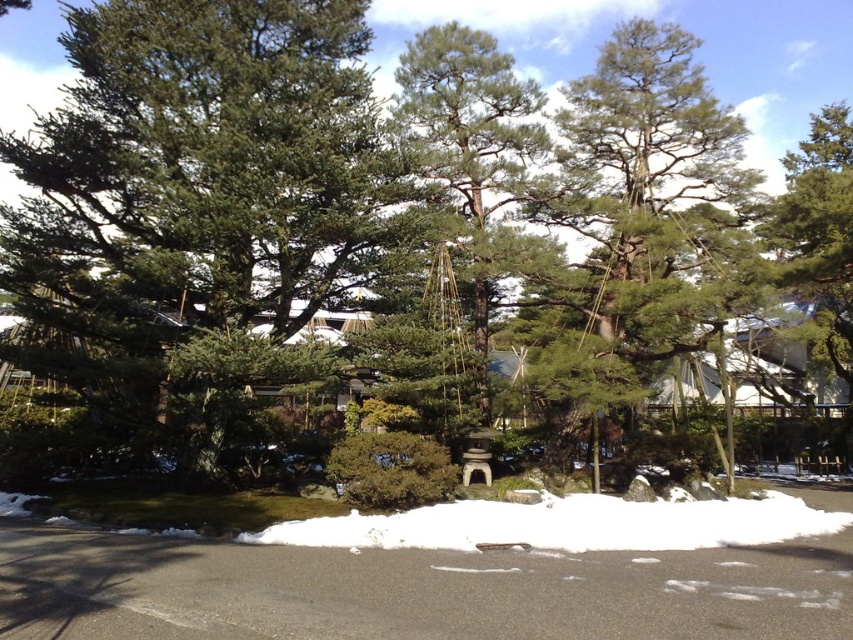
Does green matte tree at center have a greater height compared to green needle-like at center?

Yes.

Is green matte tree at center to the right of green needle-like at center from the viewer's perspective?

Incorrect, green matte tree at center is not on the right side of green needle-like at center.

Between point (337, 52) and point (508, 205), which one is positioned in front?

Point (337, 52) is in front.

Where is `green matte tree at center`? green matte tree at center is located at coordinates (201, 204).

Consider the image. Is green matte tree at center closer to the viewer compared to white powdery snow at center?

No, green matte tree at center is further to the viewer.

Consider the image. Who is more distant from viewer, (138, 396) or (555, 524)?

Positioned behind is point (138, 396).

Which is in front, point (294, 26) or point (724, 534)?

Point (724, 534) is more forward.

The width and height of the screenshot is (853, 640). Find the location of `green matte tree at center`. green matte tree at center is located at coordinates (201, 204).

Which is more to the left, green textured tree at center or white powdery snow at center?

Positioned to the left is white powdery snow at center.

Does point (639, 96) lie in front of point (560, 506)?

That is False.

Where is `green textured tree at center`? green textured tree at center is located at coordinates (650, 198).

The height and width of the screenshot is (640, 853). In order to click on green textured tree at center in this screenshot , I will do `click(650, 198)`.